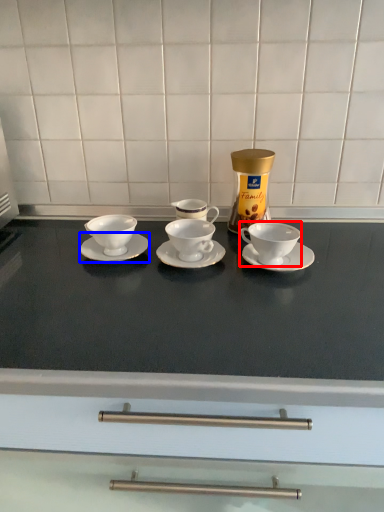
Question: Which object appears closest to the camera in this image, coffee cup (highlighted by a red box) or saucer (highlighted by a blue box)?

Choices:
 (A) coffee cup
 (B) saucer

Answer: (A)